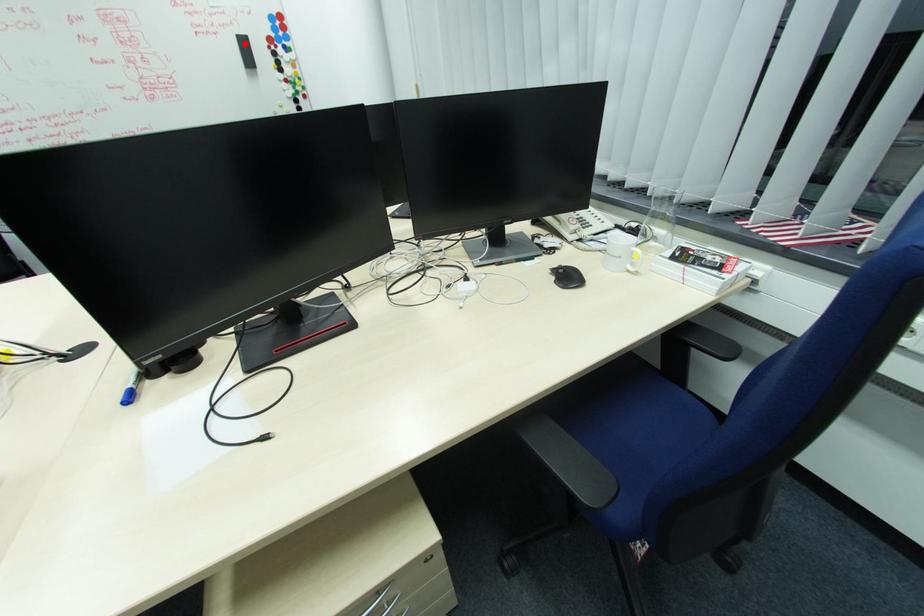
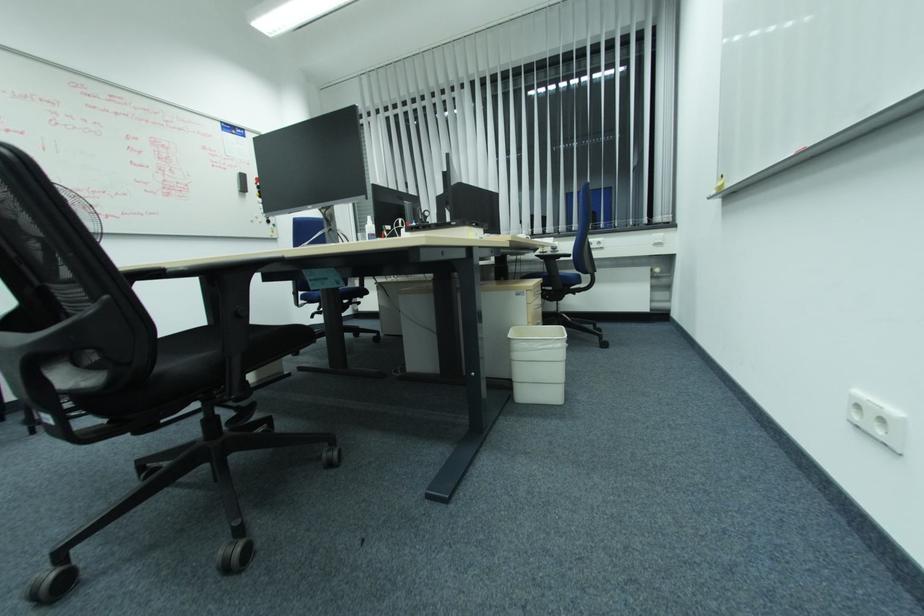
Question: I am providing you with two images of the same scene from different viewpoints. A red point is marked on the first image. At the location where the point appears in image 1, is it still visible in image 2?

Choices:
 (A) Yes
 (B) No

Answer: (A)